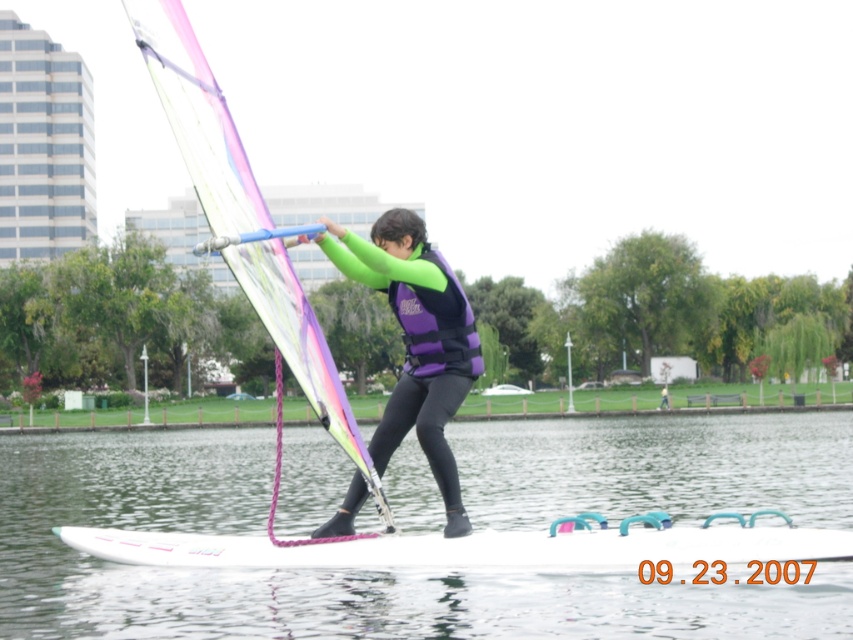
You are planning to store the white glossy surfboard at center and the purple matte life jacket at center in a storage locker. If the locker has limited space, which item should you prioritize storing first based on their sizes?

The white glossy surfboard at center occupies less space than purple matte life jacket at center, so you should prioritize storing the purple matte life jacket at center first since it takes up more space and needs more room.

You are a drone operator tasked with capturing aerial footage of the windsurfer. The purple matte life vest at center is your main focus. Based on its coordinates, can you determine if the life vest is positioned closer to the center of the image or near the edges?

The purple matte life vest at center is located at point coordinates approximately halfway between 0 and 1 on both the x and y axes, which places it near the center of the image.